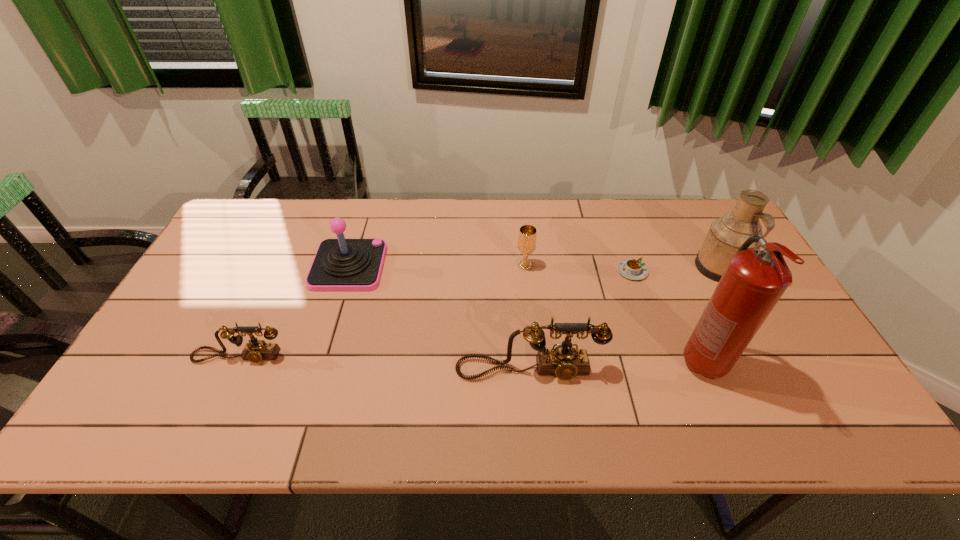
At what (x,y) coordinates should I click in order to perform the action: click on blank space at the left edge of the desktop. Please return your answer as a coordinate pair (x, y). The width and height of the screenshot is (960, 540). Looking at the image, I should click on (201, 302).

I want to click on vacant space at the right edge of the desktop, so coord(715,282).

Where is `vacant space at the far right corner`? The width and height of the screenshot is (960, 540). vacant space at the far right corner is located at coordinates (693, 198).

You are a GUI agent. You are given a task and a screenshot of the screen. Output one action in this format:
    pyautogui.click(x=<x>, y=<y>)
    Task: Click on the empty location between the left telephone and the shortest object
    
    Given the screenshot: What is the action you would take?
    pyautogui.click(x=436, y=314)

Find the location of a particular element. Image resolution: width=960 pixels, height=540 pixels. empty space that is in between the second shortest object and the taller telephone is located at coordinates (384, 363).

Identify the location of vacant space in between the left telephone and the sixth shortest object. The width and height of the screenshot is (960, 540). (479, 312).

Locate an element on the screen. empty space that is in between the left telephone and the pitcher is located at coordinates (479, 312).

Locate an element on the screen. Image resolution: width=960 pixels, height=540 pixels. blank region between the chalice and the fire extinguisher is located at coordinates (614, 314).

This screenshot has height=540, width=960. What are the coordinates of `free spot between the shorter telephone and the chalice` in the screenshot? It's located at (382, 311).

The height and width of the screenshot is (540, 960). In order to click on free space between the taller telephone and the joystick in this screenshot , I will do `click(439, 318)`.